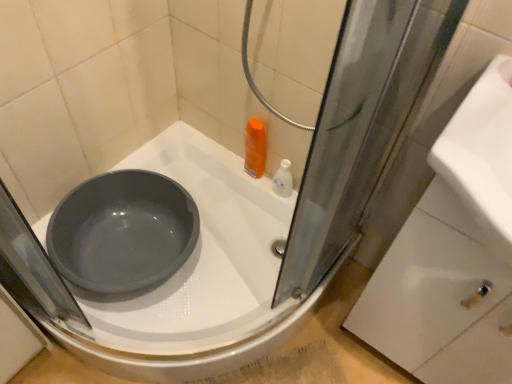
Question: From a real-world perspective, is white glossy bottle at upper right positioned under white glossy drawer at lower right based on gravity?

Choices:
 (A) no
 (B) yes

Answer: (B)

Question: Is white glossy bottle at upper right positioned before white glossy drawer at lower right?

Choices:
 (A) no
 (B) yes

Answer: (A)

Question: Does white glossy bottle at upper right have a lesser height compared to white glossy drawer at lower right?

Choices:
 (A) no
 (B) yes

Answer: (B)

Question: Does white glossy bottle at upper right have a larger size compared to white glossy drawer at lower right?

Choices:
 (A) yes
 (B) no

Answer: (B)

Question: Is white glossy bottle at upper right oriented towards white glossy drawer at lower right?

Choices:
 (A) yes
 (B) no

Answer: (B)

Question: From the image's perspective, is white glossy drawer at lower right located above or below white glossy bottle at upper right?

Choices:
 (A) below
 (B) above

Answer: (A)

Question: Choose the correct answer: Is white glossy drawer at lower right inside white glossy bottle at upper right or outside it?

Choices:
 (A) outside
 (B) inside

Answer: (A)

Question: Considering the positions of white glossy drawer at lower right and white glossy bottle at upper right in the image, is white glossy drawer at lower right taller or shorter than white glossy bottle at upper right?

Choices:
 (A) short
 (B) tall

Answer: (B)

Question: Does point (499, 349) appear closer or farther from the camera than point (284, 162)?

Choices:
 (A) closer
 (B) farther

Answer: (A)

Question: Relative to matte gray basin at center, is white glossy bottle at upper right in front or behind?

Choices:
 (A) front
 (B) behind

Answer: (B)

Question: Is white glossy bottle at upper right bigger or smaller than matte gray basin at center?

Choices:
 (A) big
 (B) small

Answer: (B)

Question: Is point (282, 175) positioned closer to the camera than point (161, 150)?

Choices:
 (A) farther
 (B) closer

Answer: (B)

Question: Is white glossy bottle at upper right inside the boundaries of matte gray basin at center, or outside?

Choices:
 (A) outside
 (B) inside

Answer: (A)

Question: Is point (283, 221) closer or farther from the camera than point (398, 327)?

Choices:
 (A) farther
 (B) closer

Answer: (A)

Question: Is matte gray basin at center bigger or smaller than white glossy drawer at lower right?

Choices:
 (A) small
 (B) big

Answer: (B)